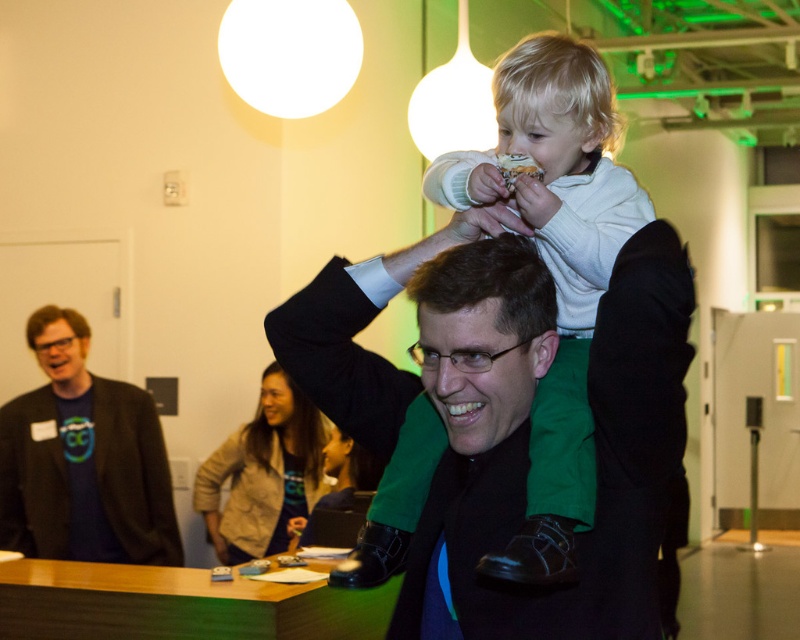
Which is more to the left, green fabric head at center or white crumbly bread at center?

From the viewer's perspective, green fabric head at center appears more on the left side.

Can you confirm if green fabric head at center is positioned above white crumbly bread at center?

No.

This screenshot has height=640, width=800. Describe the element at coordinates (484, 337) in the screenshot. I see `green fabric head at center` at that location.

Image resolution: width=800 pixels, height=640 pixels. Find the location of `green fabric head at center`. green fabric head at center is located at coordinates (484, 337).

Can you confirm if black fabric at center is shorter than matte black glasses at upper left?

No.

Between point (622, 436) and point (60, 332), which one is positioned in front?

Point (622, 436) is more forward.

Identify the location of black fabric at center. This screenshot has width=800, height=640. (517, 433).

This screenshot has height=640, width=800. I want to click on light brown fabric jacket at center, so click(262, 474).

This screenshot has width=800, height=640. Describe the element at coordinates (262, 474) in the screenshot. I see `light brown fabric jacket at center` at that location.

Where is `light brown fabric jacket at center`? light brown fabric jacket at center is located at coordinates (262, 474).